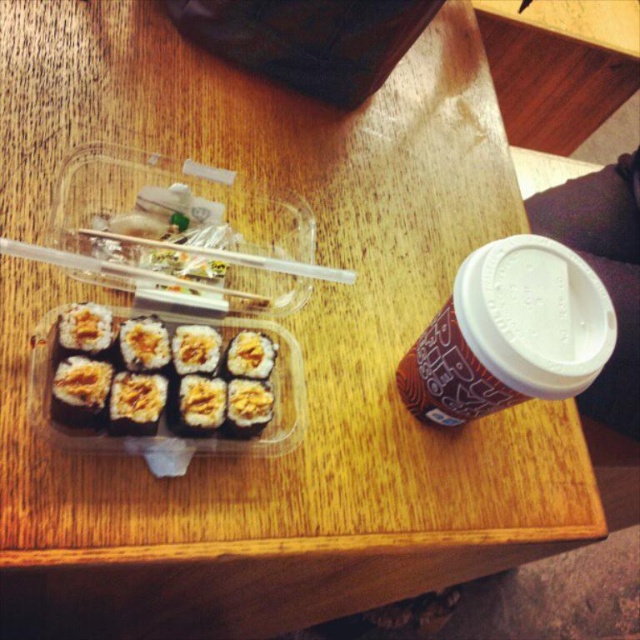
Who is positioned more to the left, matte brown cup at right or clear plastic chopsticks at upper center?

clear plastic chopsticks at upper center

Can you confirm if matte brown cup at right is thinner than clear plastic chopsticks at upper center?

Yes, matte brown cup at right is thinner than clear plastic chopsticks at upper center.

Image resolution: width=640 pixels, height=640 pixels. I want to click on matte brown cup at right, so click(509, 333).

Where is `matte brown cup at right`? The image size is (640, 640). matte brown cup at right is located at coordinates pos(509,333).

Is sushi at left below clear plastic chopsticks at upper center?

Yes, sushi at left is below clear plastic chopsticks at upper center.

Does point (180, 368) come in front of point (307, 276)?

Yes, it is.

Image resolution: width=640 pixels, height=640 pixels. I want to click on sushi at left, so click(157, 376).

Who is positioned more to the right, matte brown cup at right or sushi at left?

From the viewer's perspective, matte brown cup at right appears more on the right side.

Between point (545, 308) and point (257, 364), which one is positioned behind?

Point (257, 364)

Where is `matte brown cup at right`? The image size is (640, 640). matte brown cup at right is located at coordinates (509, 333).